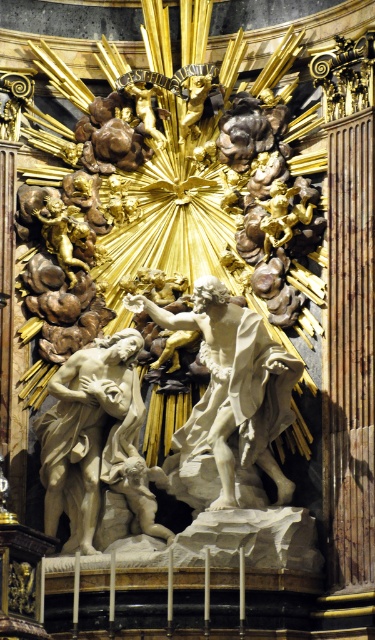
Question: Can you confirm if white marble statue at center is thinner than gold polished statue at upper center?

Choices:
 (A) yes
 (B) no

Answer: (B)

Question: From the image, what is the correct spatial relationship of white marble statue at center in relation to gold polished statue at upper center?

Choices:
 (A) right
 (B) left

Answer: (A)

Question: Which of the following is the closest to the observer?

Choices:
 (A) white marble statue at center
 (B) gold polished statue at upper center

Answer: (A)

Question: Which point is farther to the camera?

Choices:
 (A) click(199, 131)
 (B) click(193, 488)

Answer: (A)

Question: Which point is farther from the camera taking this photo?

Choices:
 (A) (172, 90)
 (B) (211, 461)

Answer: (A)

Question: From the image, what is the correct spatial relationship of white marble statue at center in relation to gold polished statue at upper center?

Choices:
 (A) above
 (B) below

Answer: (B)